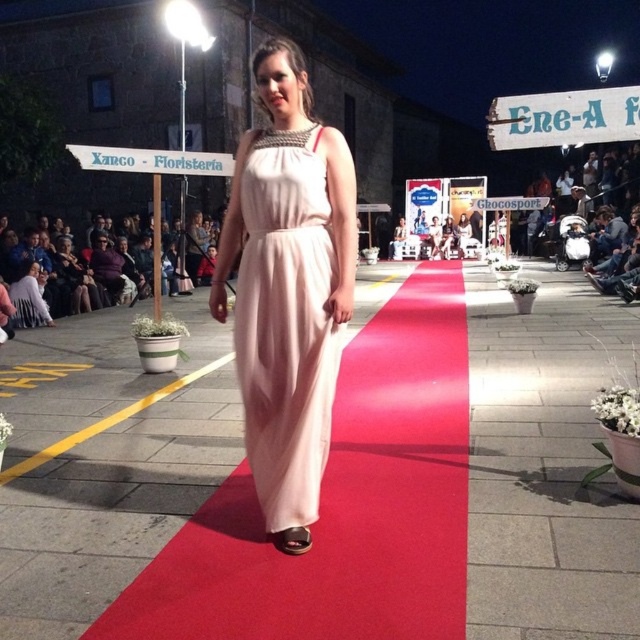
In the scene shown: Is matte pink dress at center taller than matte pink sandal at center?

Correct, matte pink dress at center is much taller as matte pink sandal at center.

Who is shorter, matte pink dress at center or matte pink sandal at center?

matte pink sandal at center is shorter.

Locate an element on the screen. This screenshot has height=640, width=640. matte pink dress at center is located at coordinates (285, 323).

I want to click on matte pink dress at center, so click(x=285, y=323).